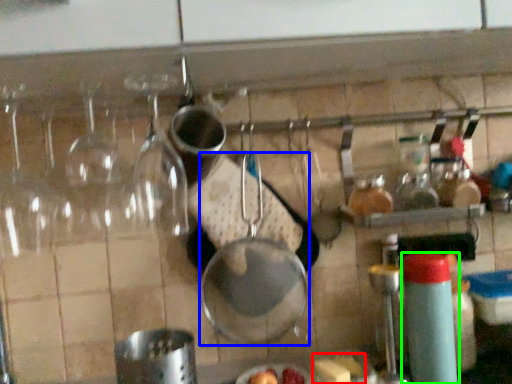
Question: Which is nearer to the food (highlighted by a red box)? frying pan (highlighted by a blue box) or bottle (highlighted by a green box).

Choices:
 (A) frying pan
 (B) bottle

Answer: (B)